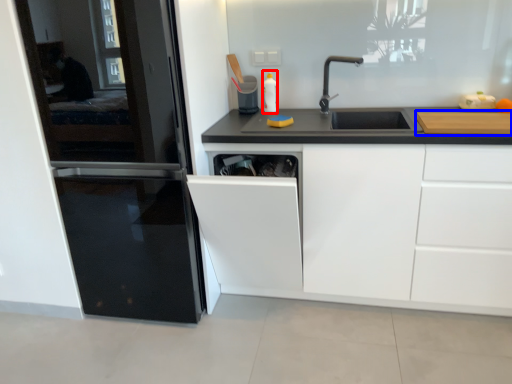
Question: Among these objects, which one is nearest to the camera, bottle (highlighted by a red box) or cutting board (highlighted by a blue box)?

Choices:
 (A) bottle
 (B) cutting board

Answer: (B)